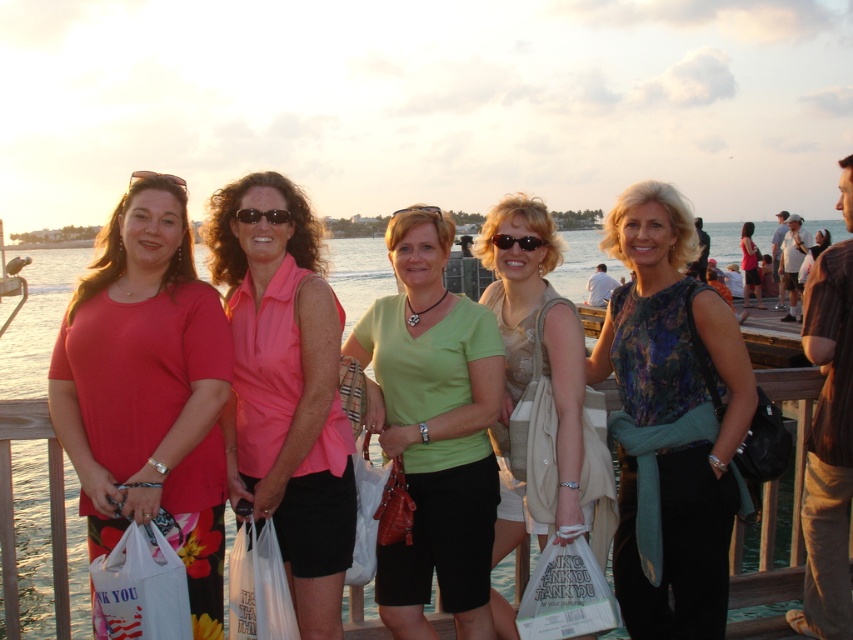
Which is below, matte pink shirt at center or clear plastic goggles at center?

matte pink shirt at center is lower down.

Who is taller, matte pink shirt at center or clear plastic goggles at center?

matte pink shirt at center is taller.

Identify the location of matte pink shirt at center. The image size is (853, 640). (148, 390).

Find the location of a particular element. matte pink shirt at center is located at coordinates (148, 390).

Does white plastic bag at center come in front of black plastic sunglasses at center?

Yes, it is in front of black plastic sunglasses at center.

Who is more forward, (271, 570) or (492, 241)?

Point (271, 570)

I want to click on white plastic bag at center, so click(x=258, y=586).

Does point (524, 236) lie behind point (184, 182)?

Yes, it is.

Who is more distant from viewer, (531,248) or (155,173)?

Positioned behind is point (531,248).

Is point (518, 241) behind point (180, 186)?

Yes, point (518, 241) is behind point (180, 186).

The image size is (853, 640). What are the coordinates of `black plastic sunglasses at center` in the screenshot? It's located at (515, 241).